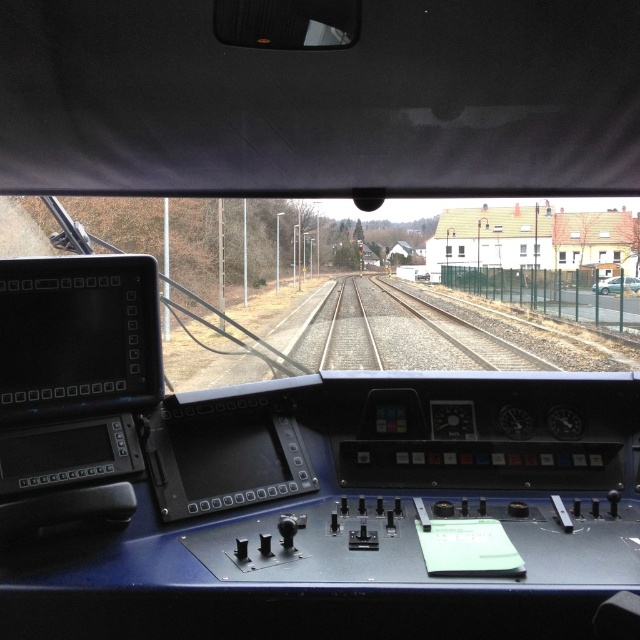
Question: Among these objects, which one is farthest from the camera?

Choices:
 (A) smooth metal train track at center
 (B) metallic silver car at right

Answer: (B)

Question: Does smooth metal train track at center appear under metallic silver car at right?

Choices:
 (A) no
 (B) yes

Answer: (B)

Question: Is smooth metal train track at center thinner than metallic silver car at right?

Choices:
 (A) no
 (B) yes

Answer: (A)

Question: Is smooth metal train track at center closer to camera compared to metallic silver car at right?

Choices:
 (A) no
 (B) yes

Answer: (B)

Question: Among these points, which one is nearest to the camera?

Choices:
 (A) (451, 368)
 (B) (632, 276)

Answer: (A)